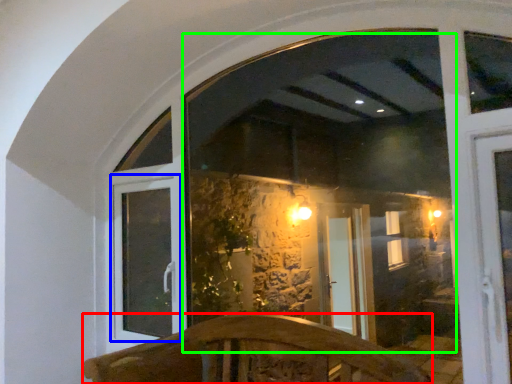
Question: Which is nearer to the furniture (highlighted by a red box)? window frame (highlighted by a blue box) or window screen (highlighted by a green box).

Choices:
 (A) window frame
 (B) window screen

Answer: (A)